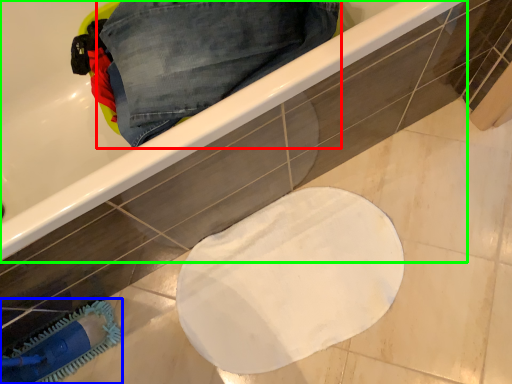
Question: Which object is positioned closest to trousers (highlighted by a red box)? Select from brush (highlighted by a blue box) and bathtub (highlighted by a green box).

Choices:
 (A) brush
 (B) bathtub

Answer: (B)